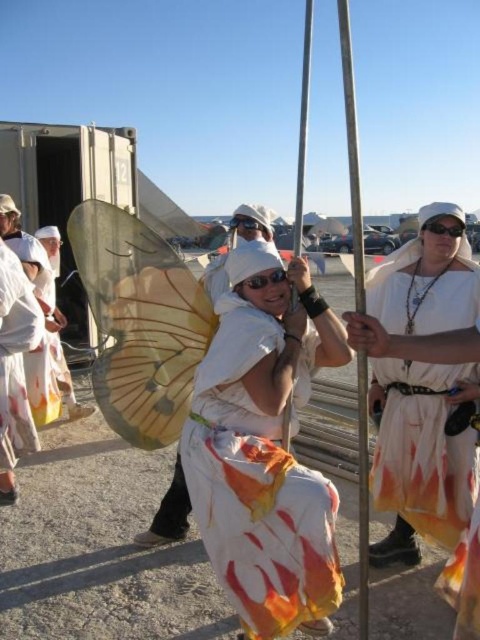
What do you see at coordinates (264, 448) in the screenshot? The width and height of the screenshot is (480, 640). I see `white paper fan at center` at bounding box center [264, 448].

From the picture: Between white paper fan at center and white cotton dress at center, which one appears on the left side from the viewer's perspective?

From the viewer's perspective, white paper fan at center appears more on the left side.

Does point (333, 515) lie behind point (448, 449)?

No, (333, 515) is closer to viewer.

Where is `white paper fan at center`? white paper fan at center is located at coordinates (264, 448).

Can you confirm if white cotton dress at center is wider than metallic pole at center?

Incorrect, white cotton dress at center's width does not surpass metallic pole at center's.

Does point (418, 368) lie in front of point (350, 108)?

Yes, point (418, 368) is closer to viewer.

Does point (381, 493) come in front of point (358, 474)?

That is True.

Image resolution: width=480 pixels, height=640 pixels. I want to click on white cotton dress at center, so click(420, 456).

Who is higher up, metallic pole at center or white fabric wings at center?

Positioned higher is metallic pole at center.

Does point (360, 266) come closer to viewer compared to point (263, 216)?

Yes, point (360, 266) is in front of point (263, 216).

Between point (368, 637) and point (187, 516), which one is positioned in front?

Point (368, 637) is in front.

Find the location of a particular element. metallic pole at center is located at coordinates (351, 154).